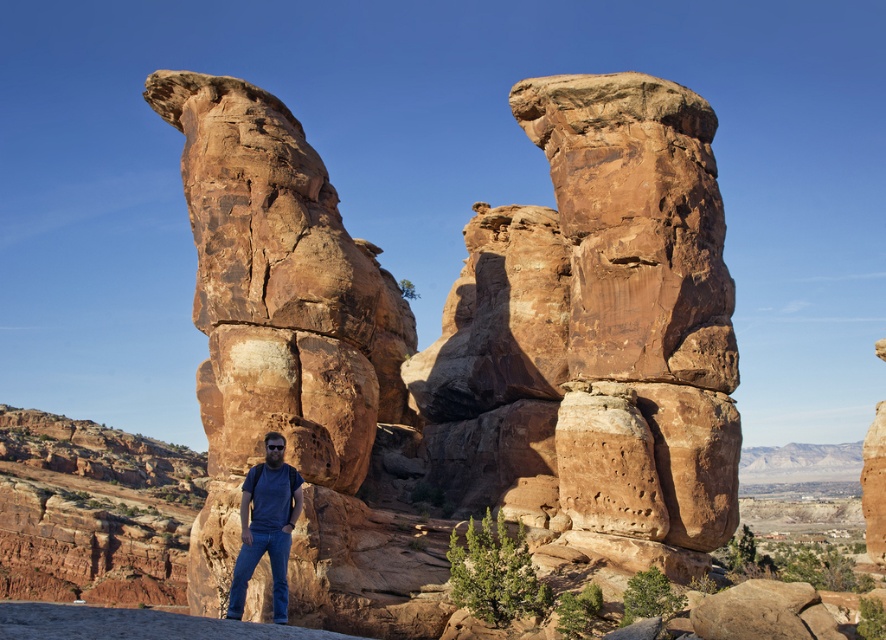
Between point (548, 140) and point (242, 515), which one is positioned behind?

The point (548, 140) is more distant.

Is rustic sandstone rock formation at center below denim jeans at lower center?

No.

You are a GUI agent. You are given a task and a screenshot of the screen. Output one action in this format:
    pyautogui.click(x=<x>, y=<y>)
    Task: Click on the rustic sandstone rock formation at center
    The width and height of the screenshot is (886, 640).
    Given the screenshot: What is the action you would take?
    pyautogui.click(x=467, y=346)

Identify the location of rustic sandstone rock formation at center. (467, 346).